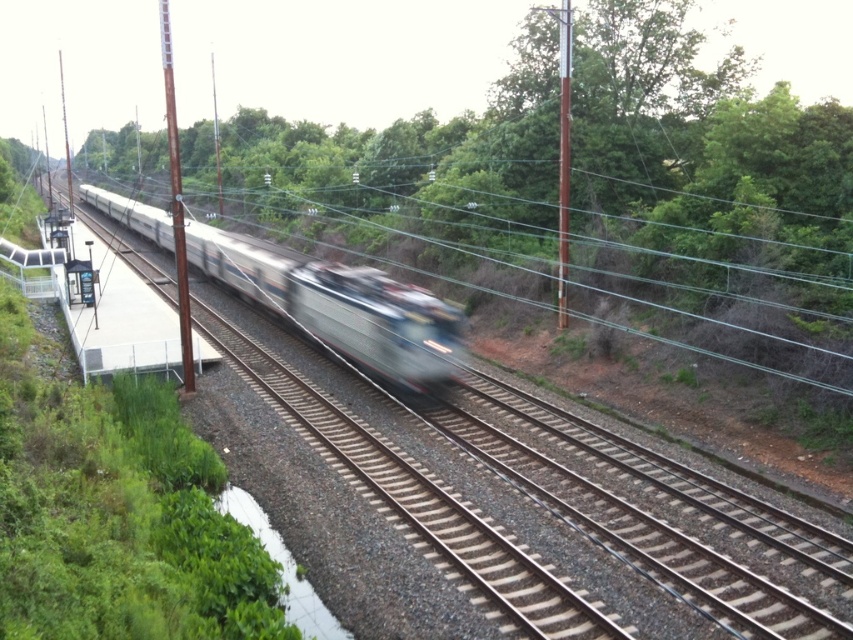
You are a photographer positioned at the origin point of the image. You want to capture the silver metallic train at center in your shot. What are the coordinates where you should aim your camera?

The silver metallic train at center is located at coordinates point (340,305), so you should aim your camera at those coordinates to capture it.